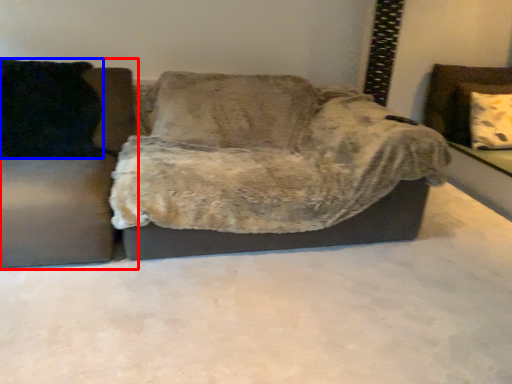
Question: Among these objects, which one is nearest to the camera, studio couch (highlighted by a red box) or pillow (highlighted by a blue box)?

Choices:
 (A) studio couch
 (B) pillow

Answer: (A)